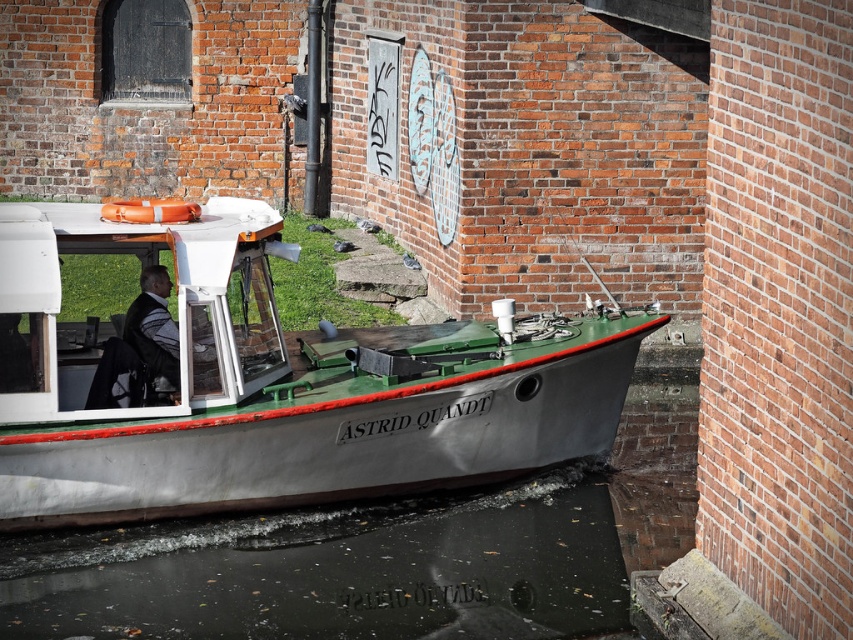
You are standing on a bridge overlooking the canal and see the green matte boat at center. If you want to throw a small object to the boat, and your throwing range is 7 meters, will you be able to reach it?

The distance between you and the green matte boat at center is 7.23 meters, which exceeds your throwing range of 7 meters. Therefore, you cannot reach it.

You are a passenger on the green matte boat at center and want to know if there is enough space to move around freely inside. Considering the boat is larger than the dark gray water at lower center, can you estimate if the cabin has sufficient space?

The green matte boat at center is larger in size than the dark gray water at lower center, but the size comparison between the boat and water does not provide information about the cabin space. You should consider other factors like cabin dimensions or available floor area for accurate assessment.